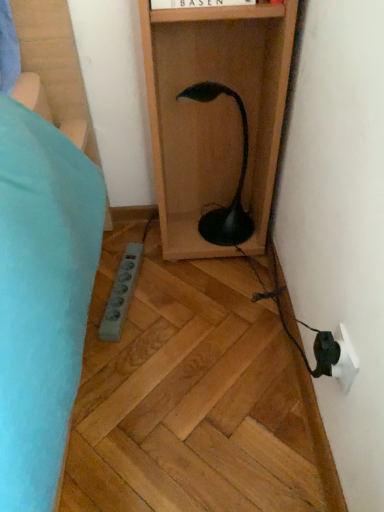
Question: From a real-world perspective, relative to black glossy lamp at center, is white plastic electric outlet at lower right vertically above or below?

Choices:
 (A) above
 (B) below

Answer: (B)

Question: Considering the relative positions of white plastic electric outlet at lower right and black glossy lamp at center in the image provided, is white plastic electric outlet at lower right to the left or to the right of black glossy lamp at center?

Choices:
 (A) left
 (B) right

Answer: (B)

Question: Is white plastic electric outlet at lower right bigger or smaller than black glossy lamp at center?

Choices:
 (A) small
 (B) big

Answer: (A)

Question: From a real-world perspective, relative to white plastic electric outlet at lower right, is black glossy lamp at center vertically above or below?

Choices:
 (A) above
 (B) below

Answer: (A)

Question: From the image's perspective, is black glossy lamp at center located above or below white plastic electric outlet at lower right?

Choices:
 (A) above
 (B) below

Answer: (A)

Question: Considering the relative positions of black glossy lamp at center and white plastic electric outlet at lower right in the image provided, is black glossy lamp at center to the left or to the right of white plastic electric outlet at lower right?

Choices:
 (A) left
 (B) right

Answer: (A)

Question: In terms of width, does black glossy lamp at center look wider or thinner when compared to white plastic electric outlet at lower right?

Choices:
 (A) wide
 (B) thin

Answer: (A)